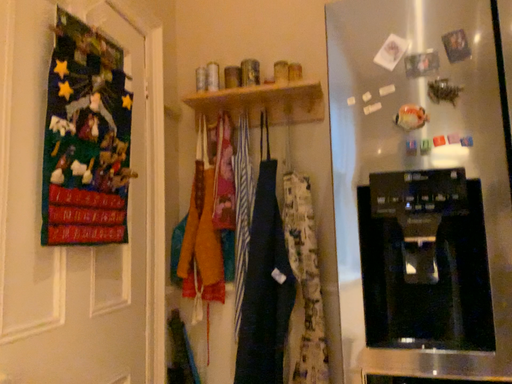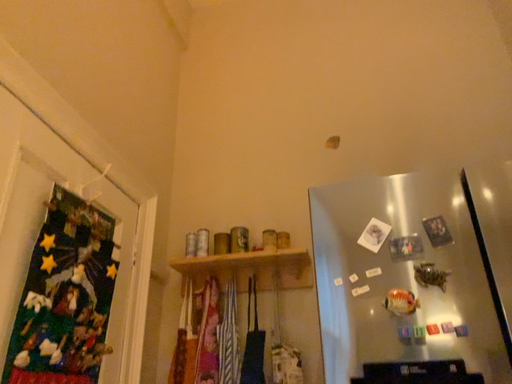
Question: Which way did the camera rotate in the video?

Choices:
 (A) rotated upward
 (B) rotated downward

Answer: (A)